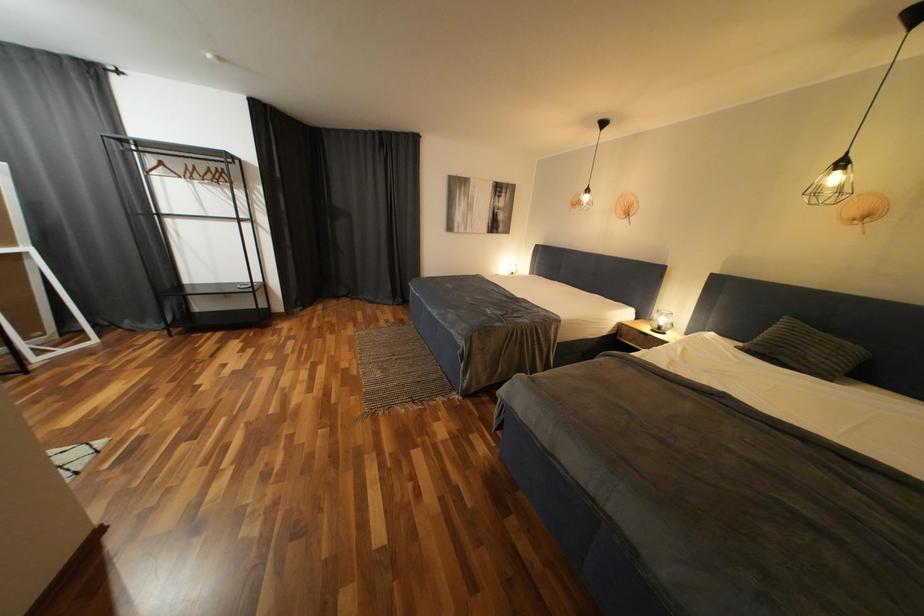
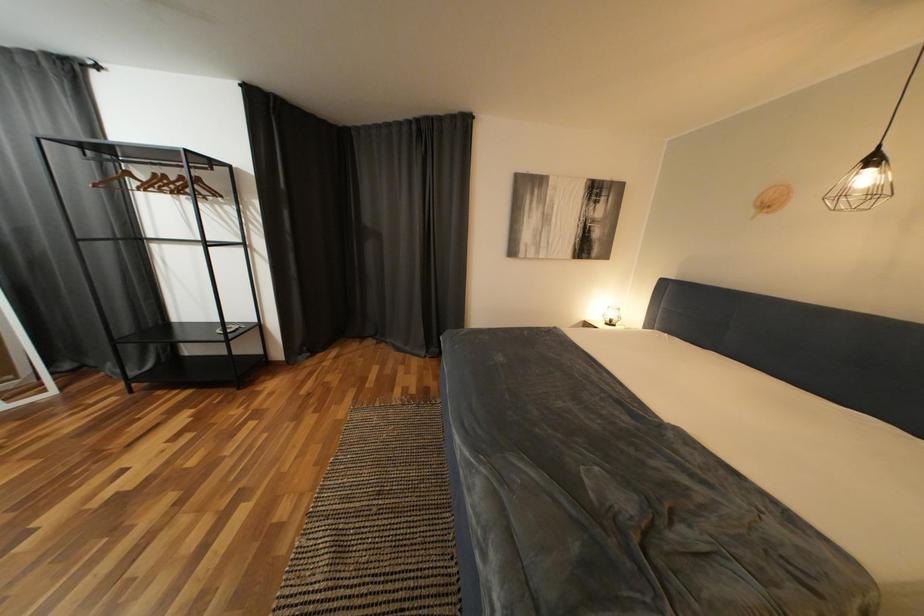
Question: The images are taken continuously from a first-person perspective. In which direction are you moving?

Choices:
 (A) Left
 (B) Right
 (C) Forward
 (D) Backward

Answer: (C)